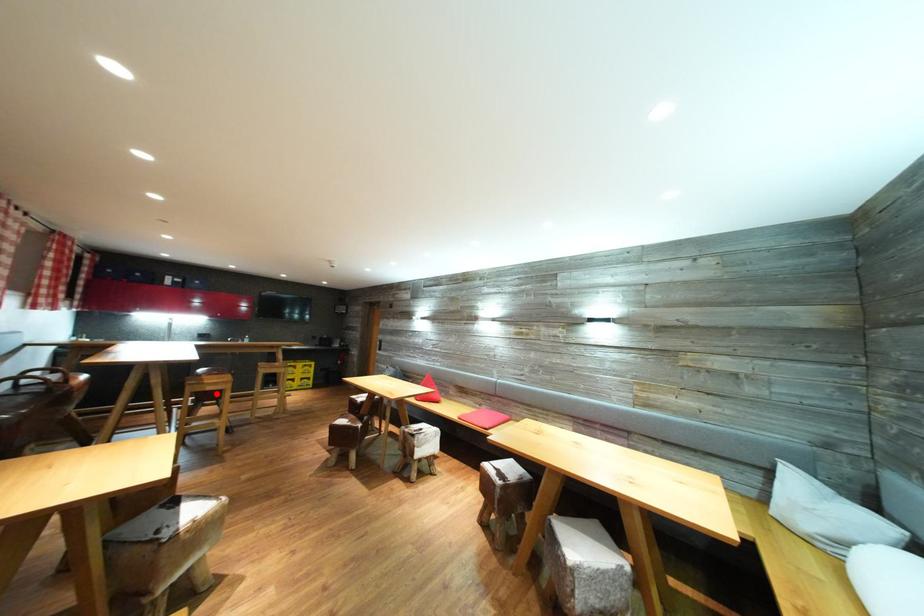
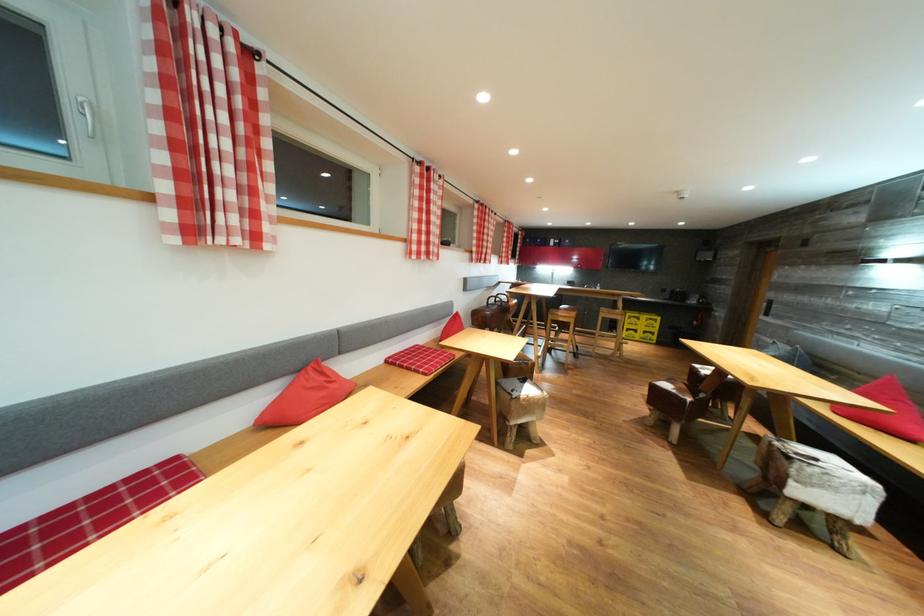
Question: A red point is marked in image1. In image2, is the corresponding 3D point closer to the camera or farther? Reply with the corresponding letter.

Choices:
 (A) The corresponding 3D point is closer.
 (B) The corresponding 3D point is farther.

Answer: (A)